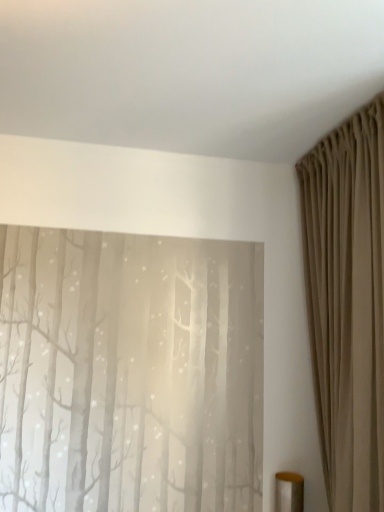
In order to face metallic gold cylinder at lower right, should I rotate leftwards or rightwards?

To face it directly, rotate right by 12.977 degrees.

Describe the element at coordinates (289, 492) in the screenshot. Image resolution: width=384 pixels, height=512 pixels. I see `metallic gold cylinder at lower right` at that location.

The image size is (384, 512). In order to click on metallic gold cylinder at lower right in this screenshot , I will do `click(289, 492)`.

What do you see at coordinates (347, 304) in the screenshot?
I see `beige fabric curtain at right` at bounding box center [347, 304].

Measure the distance between point (350, 365) and camera.

Point (350, 365) and camera are 5.02 feet apart from each other.

In order to click on beige fabric curtain at right in this screenshot , I will do `click(347, 304)`.

Locate an element on the screen. The image size is (384, 512). metallic gold cylinder at lower right is located at coordinates (289, 492).

Is metallic gold cylinder at lower right at the right side of beige fabric curtain at right?

Incorrect, metallic gold cylinder at lower right is not on the right side of beige fabric curtain at right.

Is the depth of metallic gold cylinder at lower right greater than that of beige fabric curtain at right?

Yes, metallic gold cylinder at lower right is behind beige fabric curtain at right.

Does point (287, 502) lie behind point (353, 181)?

Yes, it is.

From the image's perspective, relative to beige fabric curtain at right, is metallic gold cylinder at lower right above or below?

Based on their image positions, metallic gold cylinder at lower right is located beneath beige fabric curtain at right.

From a real-world perspective, relative to beige fabric curtain at right, is metallic gold cylinder at lower right vertically above or below?

metallic gold cylinder at lower right is below beige fabric curtain at right.

Is metallic gold cylinder at lower right wider or thinner than beige fabric curtain at right?

Clearly, metallic gold cylinder at lower right has less width compared to beige fabric curtain at right.

From the picture: Considering the sizes of objects metallic gold cylinder at lower right and beige fabric curtain at right in the image provided, who is taller, metallic gold cylinder at lower right or beige fabric curtain at right?

With more height is beige fabric curtain at right.

Is metallic gold cylinder at lower right bigger than beige fabric curtain at right?

No, metallic gold cylinder at lower right is not bigger than beige fabric curtain at right.

Is metallic gold cylinder at lower right completely or partially outside of beige fabric curtain at right?

No, most part of metallic gold cylinder at lower right lies within beige fabric curtain at right.

Is the surface of metallic gold cylinder at lower right in direct contact with beige fabric curtain at right?

There is a gap between metallic gold cylinder at lower right and beige fabric curtain at right.

Looking at this image, is metallic gold cylinder at lower right aimed at beige fabric curtain at right?

Yes, metallic gold cylinder at lower right is facing beige fabric curtain at right.

How many degrees apart are the facing directions of metallic gold cylinder at lower right and beige fabric curtain at right?

metallic gold cylinder at lower right and beige fabric curtain at right are facing 92.6 degrees away from each other.

Measure the distance from metallic gold cylinder at lower right to beige fabric curtain at right.

metallic gold cylinder at lower right and beige fabric curtain at right are 35.35 inches apart from each other.

Find the location of a particular element. This screenshot has width=384, height=512. curtain located in front of the metallic gold cylinder at lower right is located at coordinates (347, 304).

Based on their positions, is beige fabric curtain at right located to the left or right of metallic gold cylinder at lower right?

beige fabric curtain at right is positioned on metallic gold cylinder at lower right's right side.

In the image, is beige fabric curtain at right positioned in front of or behind metallic gold cylinder at lower right?

In the image, beige fabric curtain at right appears in front of metallic gold cylinder at lower right.

Does point (354, 120) lie in front of point (281, 506)?

Yes, point (354, 120) is closer to viewer.

From the image's perspective, between beige fabric curtain at right and metallic gold cylinder at lower right, who is located below?

metallic gold cylinder at lower right, from the image's perspective.

From a real-world perspective, who is located lower, beige fabric curtain at right or metallic gold cylinder at lower right?

In real-world perspective, metallic gold cylinder at lower right is lower.

Considering the relative sizes of beige fabric curtain at right and metallic gold cylinder at lower right in the image provided, is beige fabric curtain at right thinner than metallic gold cylinder at lower right?

Incorrect, the width of beige fabric curtain at right is not less than that of metallic gold cylinder at lower right.

Considering the relative sizes of beige fabric curtain at right and metallic gold cylinder at lower right in the image provided, is beige fabric curtain at right shorter than metallic gold cylinder at lower right?

No.

Does beige fabric curtain at right have a smaller size compared to metallic gold cylinder at lower right?

Incorrect, beige fabric curtain at right is not smaller in size than metallic gold cylinder at lower right.

Consider the image. Is beige fabric curtain at right not inside metallic gold cylinder at lower right?

Yes, beige fabric curtain at right is not within metallic gold cylinder at lower right.

Are beige fabric curtain at right and metallic gold cylinder at lower right far apart?

Actually, beige fabric curtain at right and metallic gold cylinder at lower right are a little close together.

Is beige fabric curtain at right oriented away from metallic gold cylinder at lower right?

That's not correct — beige fabric curtain at right is not looking away from metallic gold cylinder at lower right.

What's the angular difference between beige fabric curtain at right and metallic gold cylinder at lower right's facing directions?

92.6 degrees.

Looking at this image, how far apart are beige fabric curtain at right and metallic gold cylinder at lower right?

beige fabric curtain at right and metallic gold cylinder at lower right are 35.35 inches apart from each other.

This screenshot has height=512, width=384. Identify the location of furniture on the left of beige fabric curtain at right. (289, 492).

Locate an element on the screen. The width and height of the screenshot is (384, 512). curtain located above the metallic gold cylinder at lower right (from a real-world perspective) is located at coordinates (347, 304).

What are the coordinates of `curtain in front of the metallic gold cylinder at lower right` in the screenshot? It's located at (347, 304).